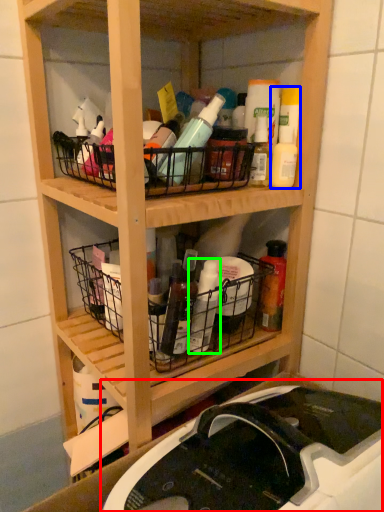
Question: Based on their relative distances, which object is farther from sink (highlighted by a red box)? Choose from cleaning product (highlighted by a blue box) and bottle (highlighted by a green box).

Choices:
 (A) cleaning product
 (B) bottle

Answer: (A)